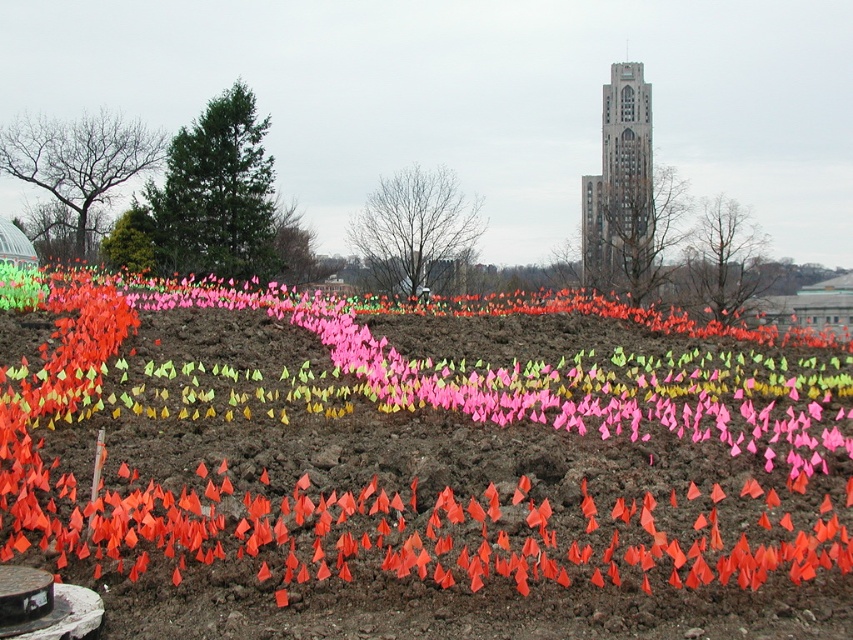
You are a landscape designer planning to install a new pathway through the field with orange paper flags at lower left and gray stone bell tower at upper center. Which object is smaller and needs to be considered for visibility in the design?

The orange paper flags at lower left are smaller than the gray stone bell tower at upper center, so they need to be considered for visibility in the design to ensure they are noticeable from a distance.

You are a gardener planning to plant flowers in the open area. You see the orange paper flags at lower left and the gray stone bell tower at upper center. Which object is closer to the ground?

The orange paper flags at lower left are closer to the ground than the gray stone bell tower at upper center, as they are positioned under it.

You are a landscape architect designing a garden layout. You need to place a new decorative stone path that must be narrower than the orange paper flags at lower left. Can the path be as wide as the gray stone bell tower at upper center?

The orange paper flags at lower left might be wider than the gray stone bell tower at upper center, so the path can be as wide as the gray stone bell tower at upper center since it is narrower than the flags.